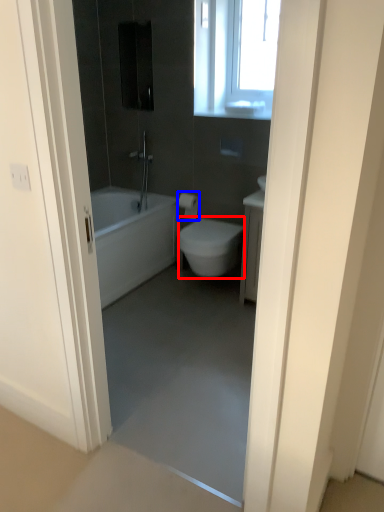
Question: Which object is closer to the camera taking this photo, bidet (highlighted by a red box) or toilet paper (highlighted by a blue box)?

Choices:
 (A) bidet
 (B) toilet paper

Answer: (A)